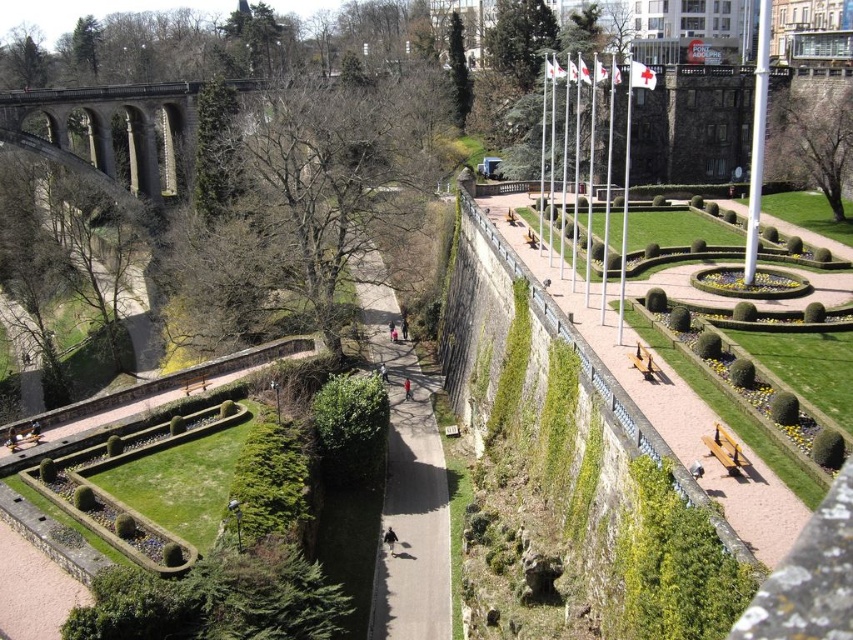
Does brown stone bridge at upper left have a larger size compared to green leafy tree at upper right?

Correct, brown stone bridge at upper left is larger in size than green leafy tree at upper right.

Does point (190, 140) come farther from viewer compared to point (830, 182)?

Yes, point (190, 140) is behind point (830, 182).

Where is `brown stone bridge at upper left`? This screenshot has width=853, height=640. brown stone bridge at upper left is located at coordinates (109, 132).

Identify the location of brown stone bridge at upper left. (109, 132).

Is bare branches at center closer to the viewer compared to green leafy hedge at center?

No, bare branches at center is behind green leafy hedge at center.

Locate an element on the screen. bare branches at center is located at coordinates (305, 205).

Does asphalt path at center appear on the right side of green leafy hedge at center?

Yes, asphalt path at center is to the right of green leafy hedge at center.

From the picture: Who is more forward, (434, 564) or (326, 428)?

Point (434, 564)

Does point (393, 371) lie in front of point (381, 442)?

That is False.

This screenshot has height=640, width=853. Find the location of `asphalt path at center`. asphalt path at center is located at coordinates (405, 481).